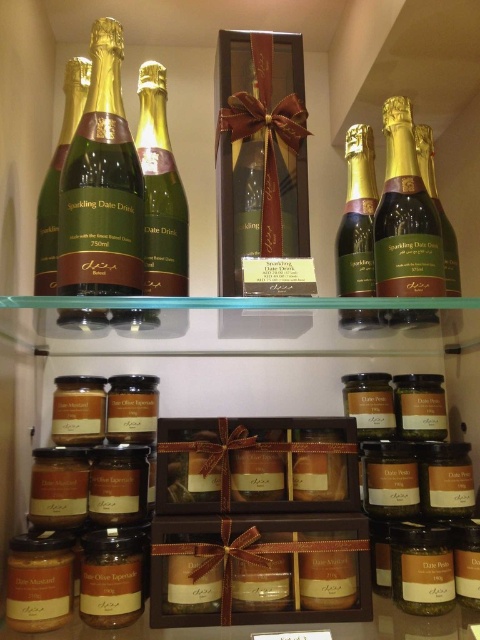
Which is more to the right, matte gold bottle at right or matte brown jar at center?

matte gold bottle at right

Which is in front, point (407, 284) or point (169, 572)?

Positioned in front is point (169, 572).

Describe the element at coordinates (406, 216) in the screenshot. I see `matte gold bottle at right` at that location.

You are a GUI agent. You are given a task and a screenshot of the screen. Output one action in this format:
    pyautogui.click(x=<x>, y=<y>)
    Task: Click on the matte gold bottle at right
    This screenshot has width=480, height=640.
    Given the screenshot: What is the action you would take?
    pyautogui.click(x=406, y=216)

Locate an element on the screen. Image resolution: width=480 pixels, height=640 pixels. gold foil champagne bottle at center is located at coordinates (358, 216).

What do you see at coordinates (358, 216) in the screenshot?
I see `gold foil champagne bottle at center` at bounding box center [358, 216].

Between point (371, 227) and point (427, 129), which one is positioned behind?

Positioned behind is point (427, 129).

Locate an element on the screen. The height and width of the screenshot is (640, 480). gold foil champagne bottle at center is located at coordinates (358, 216).

Can you confirm if matte gold bottle at right is positioned below green glass bottle at center?

Yes.

Is point (386, 102) positioned after point (155, 224)?

Yes, point (386, 102) is farther from viewer.

The image size is (480, 640). What are the coordinates of `matte gold bottle at right` in the screenshot? It's located at (406, 216).